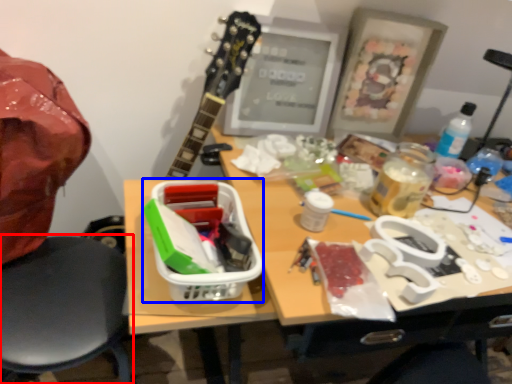
Question: Which point is closer to the camera, chair (highlighted by a red box) or lunch box (highlighted by a blue box)?

Choices:
 (A) chair
 (B) lunch box

Answer: (A)